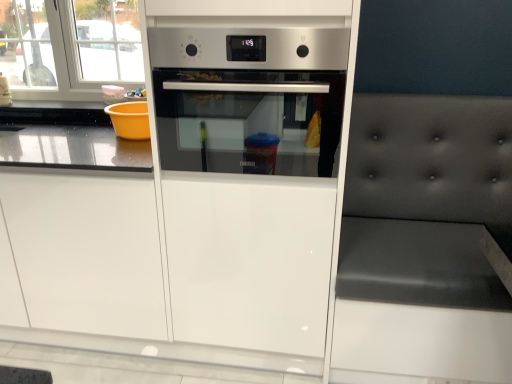
Question: From the image's perspective, is satin silver oven at center above or below satin silver oven at center?

Choices:
 (A) above
 (B) below

Answer: (B)

Question: Is satin silver oven at center bigger or smaller than satin silver oven at center?

Choices:
 (A) big
 (B) small

Answer: (A)

Question: Which of these objects is positioned closest to the satin silver oven at center?

Choices:
 (A) white glossy drawer at center
 (B) dark gray tufted cushion at right
 (C) satin silver oven at center

Answer: (C)

Question: Estimate the real-world distances between objects in this image. Which object is farther from the satin silver oven at center?

Choices:
 (A) dark gray tufted cushion at right
 (B) satin silver oven at center
 (C) white glossy drawer at center

Answer: (A)